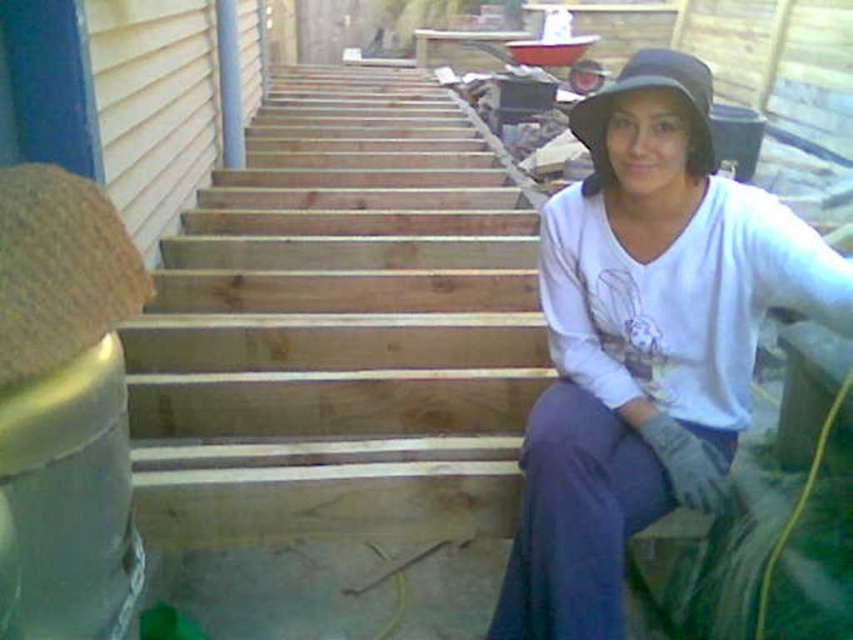
Question: Can you confirm if white matte shirt at center is thinner than black fabric hat at upper right?

Choices:
 (A) no
 (B) yes

Answer: (A)

Question: Which object is closer to the camera taking this photo?

Choices:
 (A) black fabric hat at upper right
 (B) natural wood stairs at center
 (C) white matte shirt at center

Answer: (C)

Question: Which of these objects is positioned farthest from the natural wood stairs at center?

Choices:
 (A) white matte shirt at center
 (B) black fabric hat at upper right

Answer: (B)

Question: Does white matte shirt at center appear over black fabric hat at upper right?

Choices:
 (A) yes
 (B) no

Answer: (B)

Question: Which of the following is the closest to the observer?

Choices:
 (A) (778, 244)
 (B) (694, 72)
 (C) (482, 381)

Answer: (B)

Question: Can you confirm if natural wood stairs at center is positioned below white matte shirt at center?

Choices:
 (A) yes
 (B) no

Answer: (B)